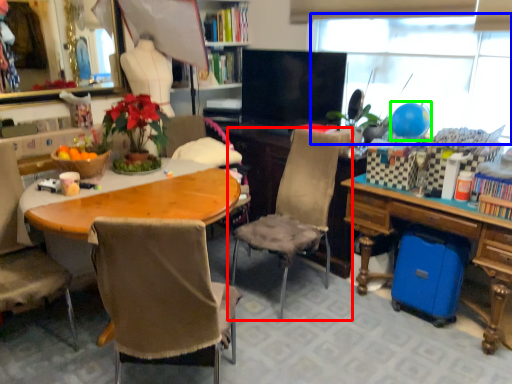
Question: Based on their relative distances, which object is nearer to chair (highlighted by a red box)? Choose from window screen (highlighted by a blue box) and balloon (highlighted by a green box).

Choices:
 (A) window screen
 (B) balloon

Answer: (B)